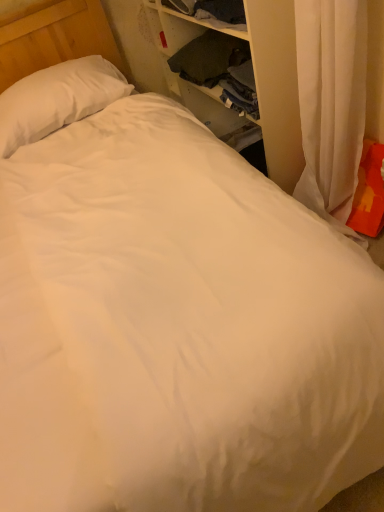
Question: From a real-world perspective, is orange fabric pillow at right, which ranks as the first pillow in bottom-to-top order, located beneath wooden dresser at upper right?

Choices:
 (A) no
 (B) yes

Answer: (B)

Question: Is orange fabric pillow at right, which is the second pillow in left-to-right order, positioned before wooden dresser at upper right?

Choices:
 (A) yes
 (B) no

Answer: (B)

Question: Could you tell me if orange fabric pillow at right, arranged as the first pillow when viewed from the front, is turned towards wooden dresser at upper right?

Choices:
 (A) no
 (B) yes

Answer: (A)

Question: Is orange fabric pillow at right, the first pillow viewed from the right, smaller than wooden dresser at upper right?

Choices:
 (A) no
 (B) yes

Answer: (B)

Question: Does orange fabric pillow at right, arranged as the first pillow when viewed from the front, have a greater height compared to wooden dresser at upper right?

Choices:
 (A) no
 (B) yes

Answer: (A)

Question: Which is correct: white soft pillow at upper left, the 2th pillow positioned from the bottom, is inside wooden dresser at upper right, or outside of it?

Choices:
 (A) outside
 (B) inside

Answer: (A)

Question: Is point (79, 101) positioned closer to the camera than point (297, 115)?

Choices:
 (A) closer
 (B) farther

Answer: (B)

Question: Is white soft pillow at upper left, the 2th pillow positioned from the bottom, taller or shorter than wooden dresser at upper right?

Choices:
 (A) short
 (B) tall

Answer: (A)

Question: Would you say white soft pillow at upper left, which is counted as the 1th pillow, starting from the top, is to the left or to the right of wooden dresser at upper right in the picture?

Choices:
 (A) left
 (B) right

Answer: (A)

Question: Considering the positions of wooden dresser at upper right and white soft pillow at upper left, acting as the 1th pillow starting from the back, in the image, is wooden dresser at upper right taller or shorter than white soft pillow at upper left, acting as the 1th pillow starting from the back,?

Choices:
 (A) short
 (B) tall

Answer: (B)

Question: From the image's perspective, is wooden dresser at upper right located above or below white soft pillow at upper left, acting as the 1th pillow starting from the back?

Choices:
 (A) above
 (B) below

Answer: (A)

Question: From a real-world perspective, is wooden dresser at upper right physically located above or below white soft pillow at upper left, which is counted as the 1th pillow, starting from the top?

Choices:
 (A) below
 (B) above

Answer: (A)

Question: Is point (264, 15) closer or farther from the camera than point (81, 97)?

Choices:
 (A) closer
 (B) farther

Answer: (A)

Question: Is orange fabric pillow at right, which is the second pillow in left-to-right order, situated inside wooden dresser at upper right or outside?

Choices:
 (A) inside
 (B) outside

Answer: (B)

Question: From a real-world perspective, is orange fabric pillow at right, arranged as the first pillow when viewed from the front, positioned above or below wooden dresser at upper right?

Choices:
 (A) above
 (B) below

Answer: (B)